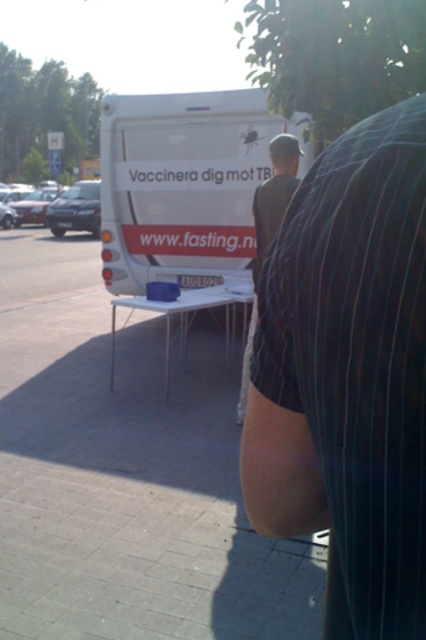
How far apart are black pinstripe shirt at center and white matte van at center?

They are 6.88 meters apart.

The height and width of the screenshot is (640, 426). What do you see at coordinates (348, 376) in the screenshot?
I see `black pinstripe shirt at center` at bounding box center [348, 376].

You are a GUI agent. You are given a task and a screenshot of the screen. Output one action in this format:
    pyautogui.click(x=<x>, y=<y>)
    Task: Click on the black pinstripe shirt at center
    
    Given the screenshot: What is the action you would take?
    pyautogui.click(x=348, y=376)

Can you confirm if black pinstripe shirt at center is smaller than dark gray shirt at center?

Indeed, black pinstripe shirt at center has a smaller size compared to dark gray shirt at center.

Is point (356, 305) positioned behind point (249, 333)?

No, (356, 305) is closer to viewer.

Is point (416, 568) behind point (299, 148)?

No, it is not.

Image resolution: width=426 pixels, height=640 pixels. In order to click on black pinstripe shirt at center in this screenshot , I will do tap(348, 376).

Is white matte van at center above dark gray shirt at center?

Yes.

What do you see at coordinates (181, 182) in the screenshot?
I see `white matte van at center` at bounding box center [181, 182].

Identify the location of white matte van at center. (181, 182).